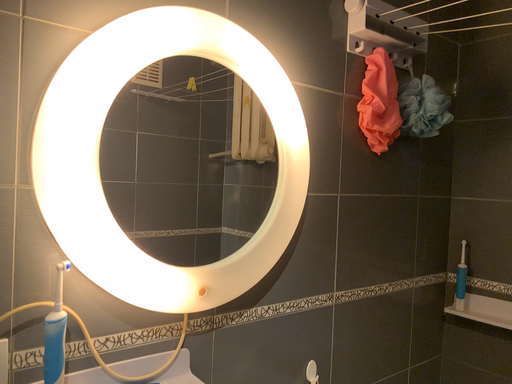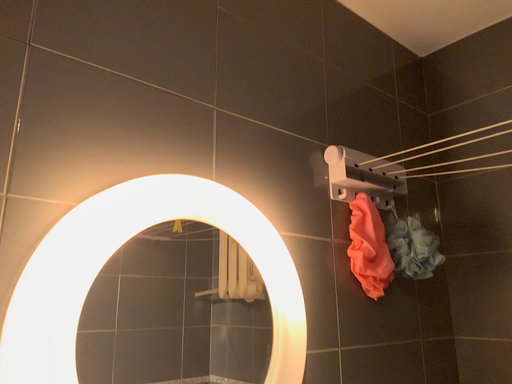
Question: How did the camera likely rotate when shooting the video?

Choices:
 (A) rotated upward
 (B) rotated downward

Answer: (A)